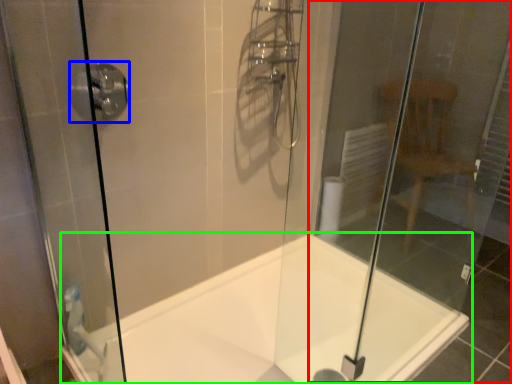
Question: Estimate the real-world distances between objects in this image. Which object is farther from glass door (highlighted by a red box), shower (highlighted by a blue box) or bathtub (highlighted by a green box)?

Choices:
 (A) shower
 (B) bathtub

Answer: (A)